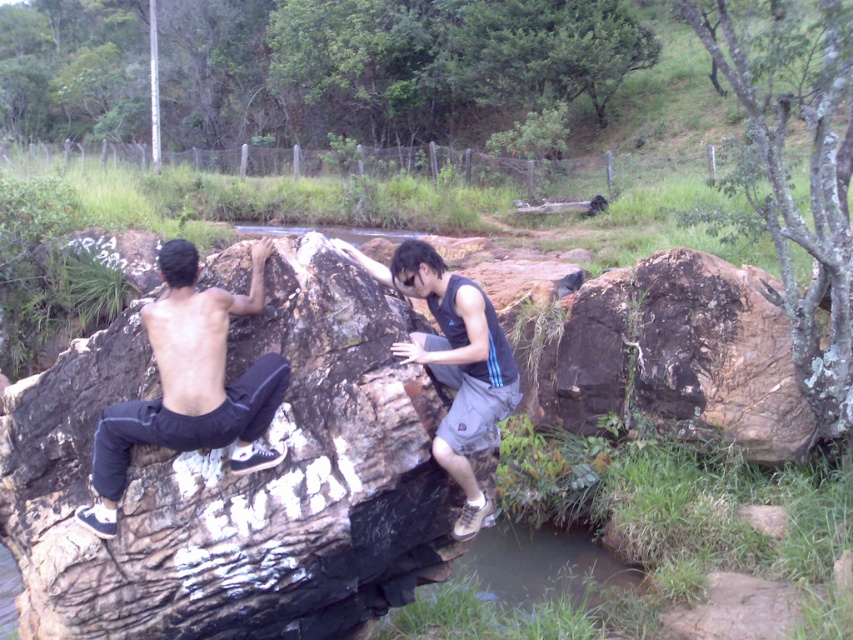
Is point (100, 376) positioned behind point (799, 429)?

No, (100, 376) is closer to viewer.

From the picture: Does rough textured rock at center have a larger size compared to brown rough rock at right?

Yes.

Based on the photo, measure the distance between rough textured rock at center and camera.

They are 3.52 meters apart.

Identify the location of rough textured rock at center. (236, 477).

Is point (712, 410) closer to viewer compared to point (160, 323)?

That is False.

Can you confirm if brown rough rock at right is positioned below black matte pants at left?

Actually, brown rough rock at right is above black matte pants at left.

Is point (689, 332) positioned in front of point (167, 342)?

No.

Find the location of a particular element. The width and height of the screenshot is (853, 640). brown rough rock at right is located at coordinates pos(679,355).

Which is more to the left, rough textured rock at center or dark blue sleeveless shirt at center?

rough textured rock at center

Does point (360, 340) come behind point (407, 285)?

No, it is not.

Identify the location of rough textured rock at center. (236, 477).